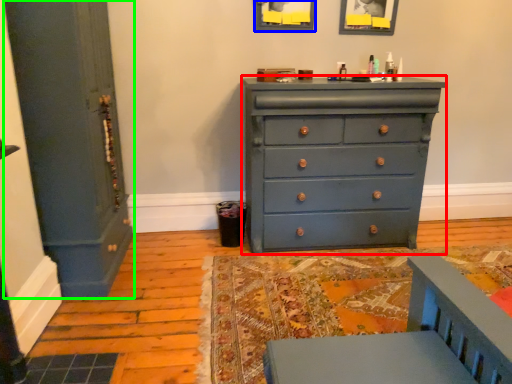
Question: Estimate the real-world distances between objects in this image. Which object is farther from chest of drawers (highlighted by a red box), picture frame (highlighted by a blue box) or door (highlighted by a green box)?

Choices:
 (A) picture frame
 (B) door

Answer: (B)